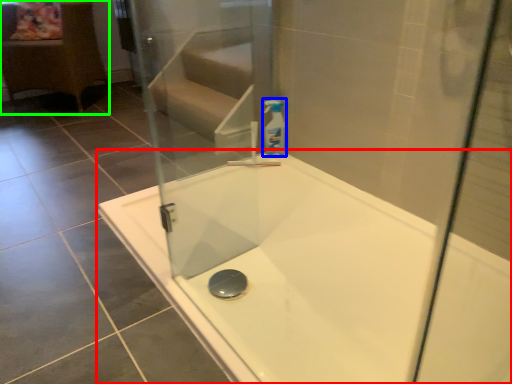
Question: Based on their relative distances, which object is farther from bathtub (highlighted by a red box)? Choose from cleaning product (highlighted by a blue box) and furniture (highlighted by a green box).

Choices:
 (A) cleaning product
 (B) furniture

Answer: (B)